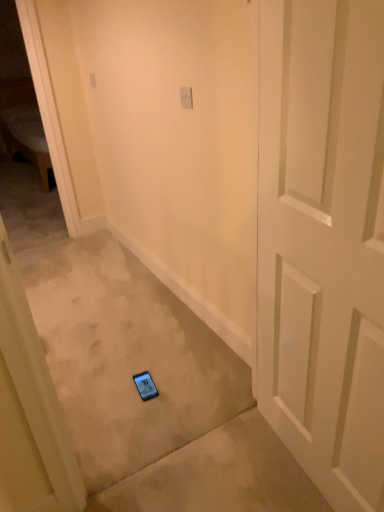
Question: Can you confirm if white plastic light switch at upper center, which is the second light switch in bottom-to-top order, is shorter than white plastic light switch at upper center, positioned as the 1th light switch in front-to-back order?

Choices:
 (A) no
 (B) yes

Answer: (A)

Question: From the image's perspective, is white plastic light switch at upper center, the 2th light switch viewed from the front, below white plastic light switch at upper center, positioned as the 1th light switch in front-to-back order?

Choices:
 (A) yes
 (B) no

Answer: (B)

Question: Is white plastic light switch at upper center, the second light switch when ordered from right to left, closer to the viewer compared to white plastic light switch at upper center, positioned as the 1th light switch in front-to-back order?

Choices:
 (A) no
 (B) yes

Answer: (A)

Question: Is white plastic light switch at upper center, which appears as the 1th light switch when viewed from the top, at the left side of white plastic light switch at upper center, positioned as the 1th light switch in front-to-back order?

Choices:
 (A) yes
 (B) no

Answer: (A)

Question: Can you confirm if white plastic light switch at upper center, the second light switch when ordered from right to left, is positioned to the right of white plastic light switch at upper center, which ranks as the 2th light switch in top-to-bottom order?

Choices:
 (A) yes
 (B) no

Answer: (B)

Question: Based on their sizes in the image, would you say white plastic light switch at upper center, which is the second light switch in bottom-to-top order, is bigger or smaller than white matte door at center?

Choices:
 (A) big
 (B) small

Answer: (B)

Question: Is white plastic light switch at upper center, which is the second light switch in bottom-to-top order, in front of or behind white matte door at center in the image?

Choices:
 (A) behind
 (B) front

Answer: (A)

Question: Is white plastic light switch at upper center, which appears as the 1th light switch when viewed from the top, inside the boundaries of white matte door at center, or outside?

Choices:
 (A) inside
 (B) outside

Answer: (B)

Question: Is point (91, 80) positioned closer to the camera than point (380, 494)?

Choices:
 (A) closer
 (B) farther

Answer: (B)

Question: From the image's perspective, is white plastic light switch at upper center, acting as the first light switch starting from the back, positioned above or below white plastic light switch at upper center, which is the 2th light switch from back to front?

Choices:
 (A) above
 (B) below

Answer: (A)

Question: Relative to white plastic light switch at upper center, positioned as the 1th light switch in front-to-back order, is white plastic light switch at upper center, the 2th light switch viewed from the front, in front or behind?

Choices:
 (A) behind
 (B) front

Answer: (A)

Question: Based on their sizes in the image, would you say white plastic light switch at upper center, which appears as the 1th light switch when viewed from the top, is bigger or smaller than white plastic light switch at upper center, which is the second light switch in left-to-right order?

Choices:
 (A) big
 (B) small

Answer: (A)

Question: Considering the positions of white plastic light switch at upper center, the second light switch when ordered from right to left, and white plastic light switch at upper center, which is counted as the first light switch, starting from the bottom, in the image, is white plastic light switch at upper center, the second light switch when ordered from right to left, wider or thinner than white plastic light switch at upper center, which is counted as the first light switch, starting from the bottom,?

Choices:
 (A) thin
 (B) wide

Answer: (B)

Question: In terms of width, does white plastic light switch at upper center, which is counted as the first light switch, starting from the bottom, look wider or thinner when compared to white matte door at center?

Choices:
 (A) wide
 (B) thin

Answer: (B)

Question: Considering the relative positions of white plastic light switch at upper center, which is counted as the first light switch, starting from the bottom, and white matte door at center in the image provided, is white plastic light switch at upper center, which is counted as the first light switch, starting from the bottom, to the left or to the right of white matte door at center?

Choices:
 (A) right
 (B) left

Answer: (B)